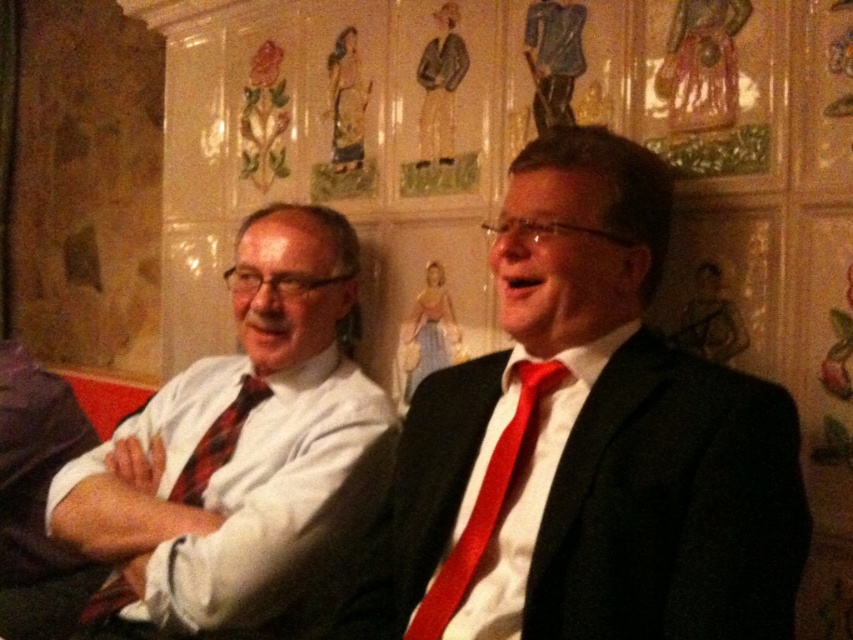
Does matte red tie at left have a greater height compared to red satin tie at right?

Yes, matte red tie at left is taller than red satin tie at right.

Is matte red tie at left to the left of red satin tie at right from the viewer's perspective?

Indeed, matte red tie at left is positioned on the left side of red satin tie at right.

Does point (148, 576) come farther from viewer compared to point (521, 381)?

That is True.

The height and width of the screenshot is (640, 853). Identify the location of matte red tie at left. (241, 444).

Which is more to the right, matte black suit at center or matte red tie at left?

From the viewer's perspective, matte black suit at center appears more on the right side.

Which of these two, matte black suit at center or matte red tie at left, stands taller?

Standing taller between the two is matte red tie at left.

The width and height of the screenshot is (853, 640). I want to click on matte black suit at center, so click(590, 440).

Who is taller, matte black suit at center or red plaid tie at left?

Standing taller between the two is matte black suit at center.

Is matte black suit at center shorter than red plaid tie at left?

No, matte black suit at center is not shorter than red plaid tie at left.

The image size is (853, 640). I want to click on matte black suit at center, so click(590, 440).